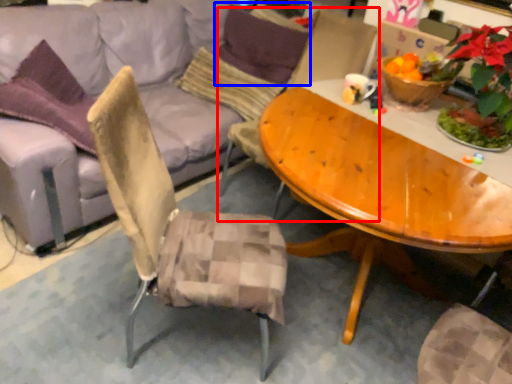
Question: Which object appears farthest to the camera in this image, chair (highlighted by a red box) or pillow (highlighted by a blue box)?

Choices:
 (A) chair
 (B) pillow

Answer: (B)